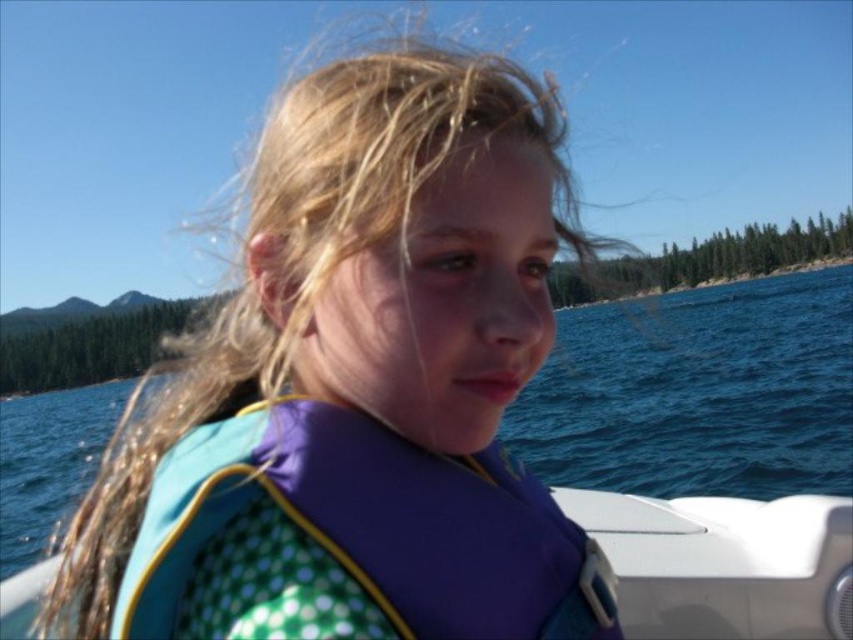
Question: Which point appears farthest from the camera in this image?

Choices:
 (A) (701, 360)
 (B) (378, 600)
 (C) (350, 150)

Answer: (A)

Question: Can you confirm if blue polka dot life vest at center is positioned above blue water at center?

Choices:
 (A) no
 (B) yes

Answer: (B)

Question: Does blue polka dot life vest at center have a lesser width compared to polka dot fabric life jacket at center?

Choices:
 (A) no
 (B) yes

Answer: (A)

Question: Is polka dot fabric life jacket at center in front of blue water at center?

Choices:
 (A) yes
 (B) no

Answer: (A)

Question: Estimate the real-world distances between objects in this image. Which object is farther from the blue polka dot life vest at center?

Choices:
 (A) polka dot fabric life jacket at center
 (B) blue water at center

Answer: (B)

Question: Which object is the closest to the blue water at center?

Choices:
 (A) polka dot fabric life jacket at center
 (B) blue polka dot life vest at center

Answer: (A)